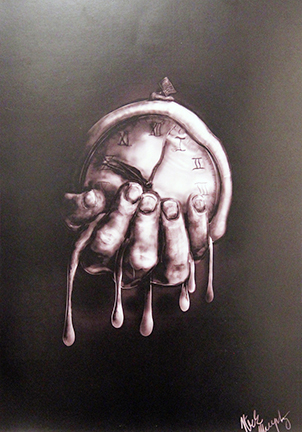
You are a GUI agent. You are given a task and a screenshot of the screen. Output one action in this format:
    pyautogui.click(x=<x>, y=<y>)
    Task: Click on the clock
    Image resolution: width=302 pixels, height=432 pixels.
    Given the screenshot: What is the action you would take?
    pyautogui.click(x=165, y=163)